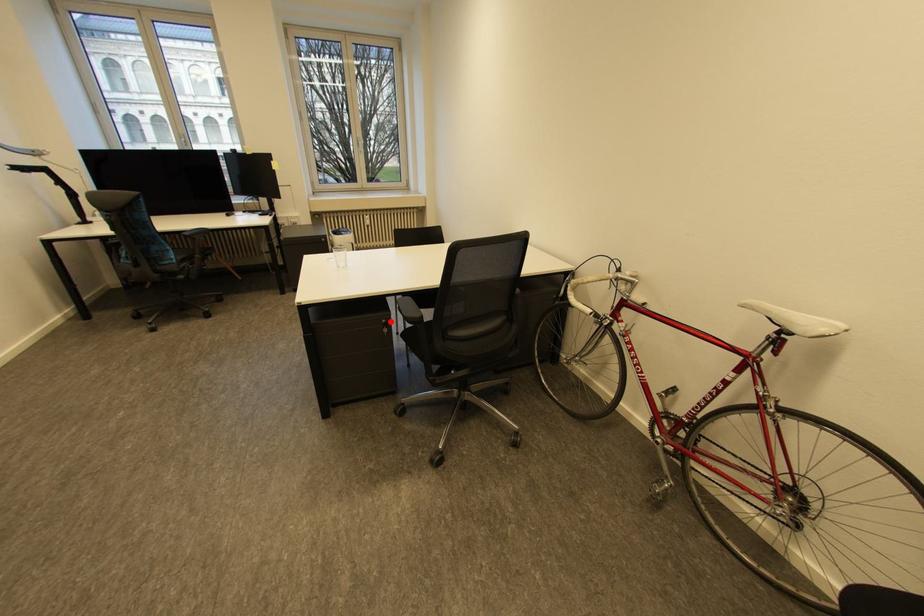
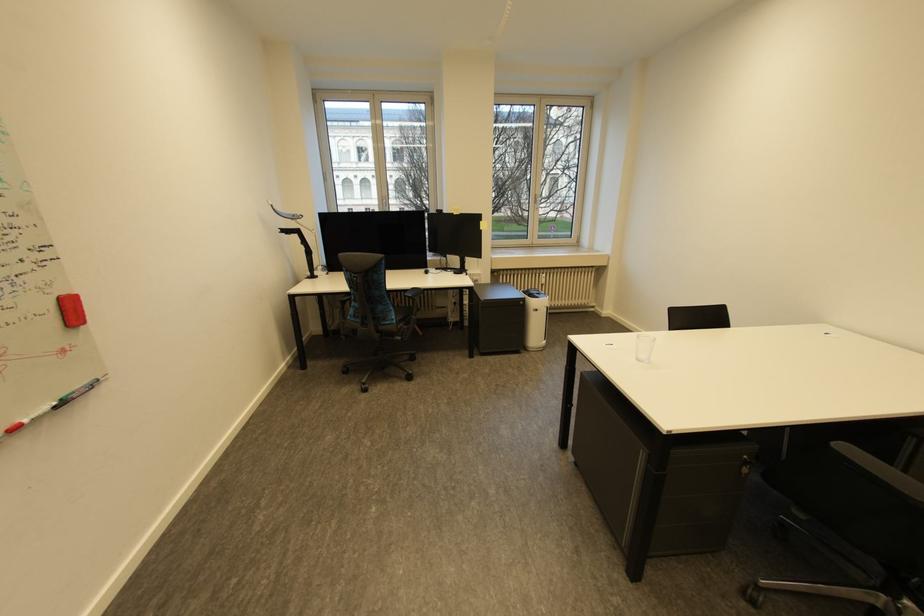
Where in the second image is the point corresponding to the highlighted location from the first image?

(752, 456)